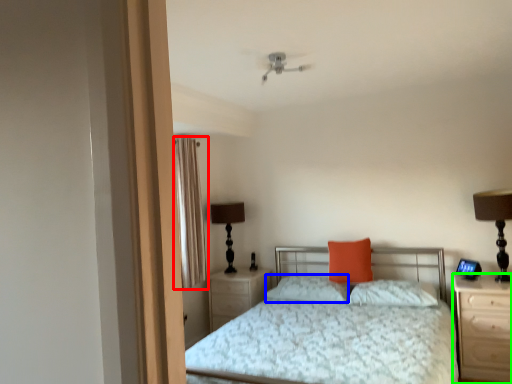
Question: Based on their relative distances, which object is nearer to curtain (highlighted by a red box)? Choose from pillow (highlighted by a blue box) and nightstand (highlighted by a green box).

Choices:
 (A) pillow
 (B) nightstand

Answer: (A)